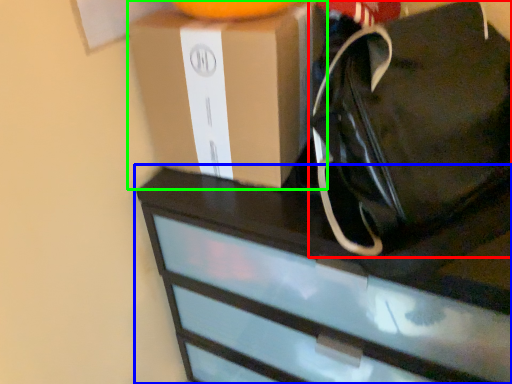
Question: Estimate the real-world distances between objects in this image. Which object is closer to tote bag (highlighted by a red box), chest of drawers (highlighted by a blue box) or box (highlighted by a green box)?

Choices:
 (A) chest of drawers
 (B) box

Answer: (B)